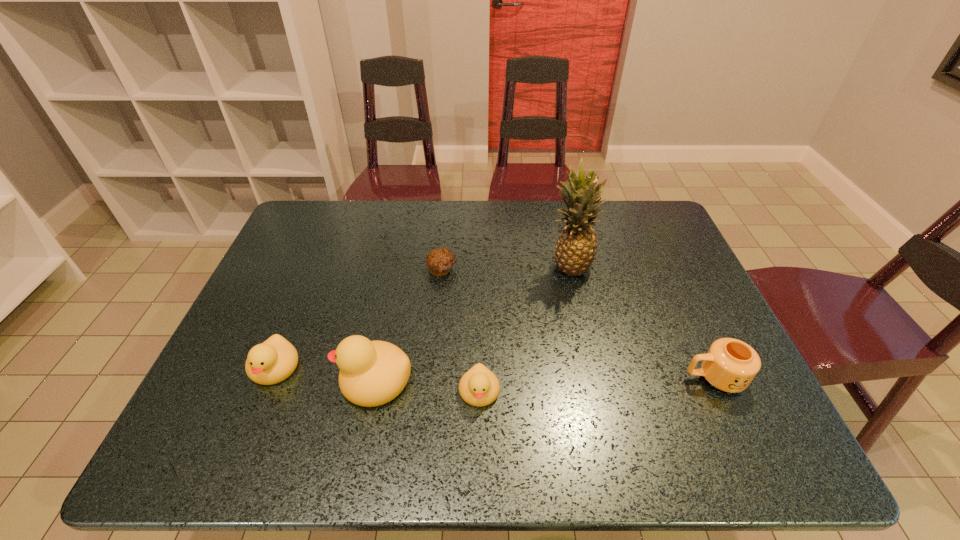
This screenshot has height=540, width=960. Identify the location of vacant point that satisfies the following two spatial constraints: 1. on the handle side of the rightmost object; 2. on the face of the fourth object from left to right. (720, 392).

Where is `blank area in the image that satisfies the following two spatial constraints: 1. on the handle side of the mug; 2. on the face of the shortest duckling`? This screenshot has height=540, width=960. blank area in the image that satisfies the following two spatial constraints: 1. on the handle side of the mug; 2. on the face of the shortest duckling is located at coordinates (720, 392).